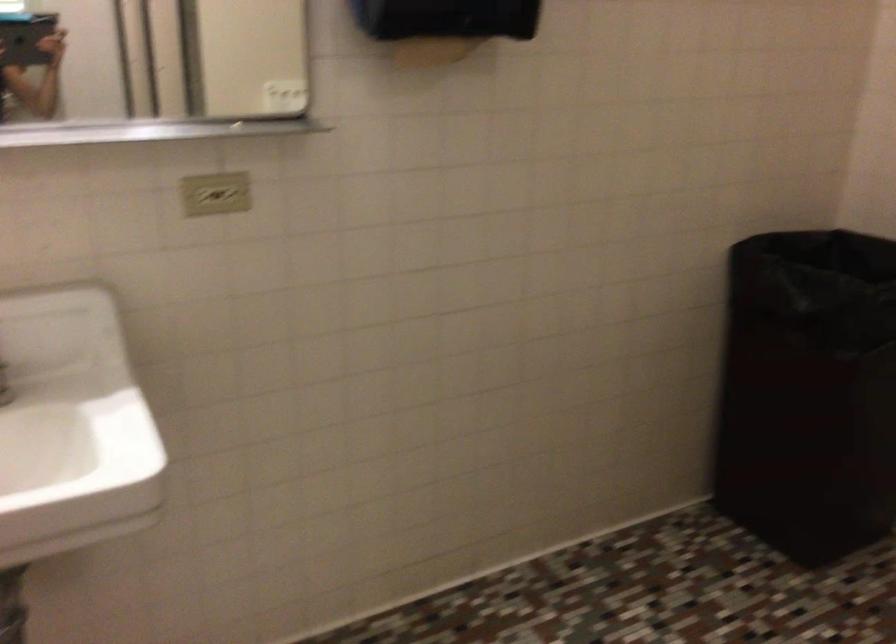
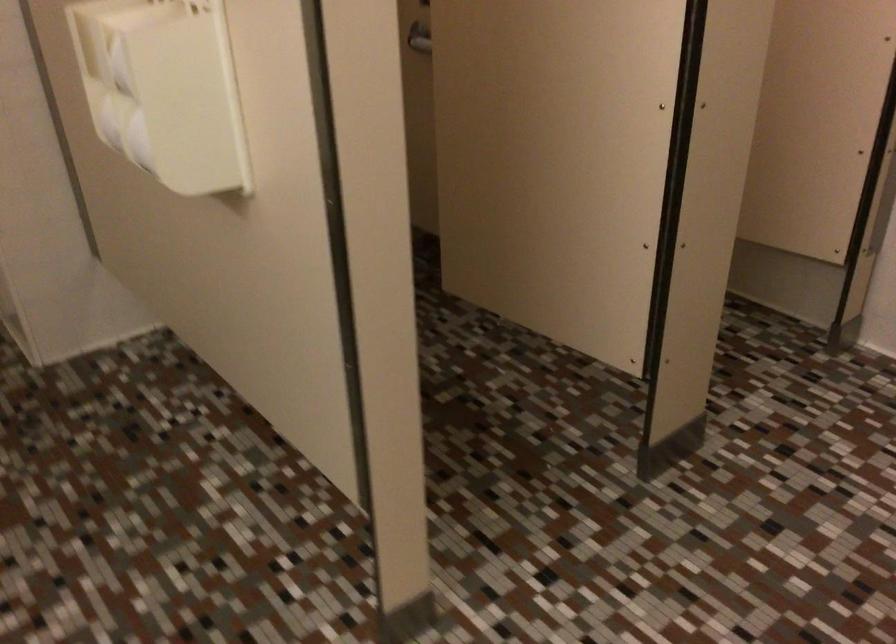
Based on the continuous images, in which direction is the camera rotating?

The camera's rotation is toward right-down.